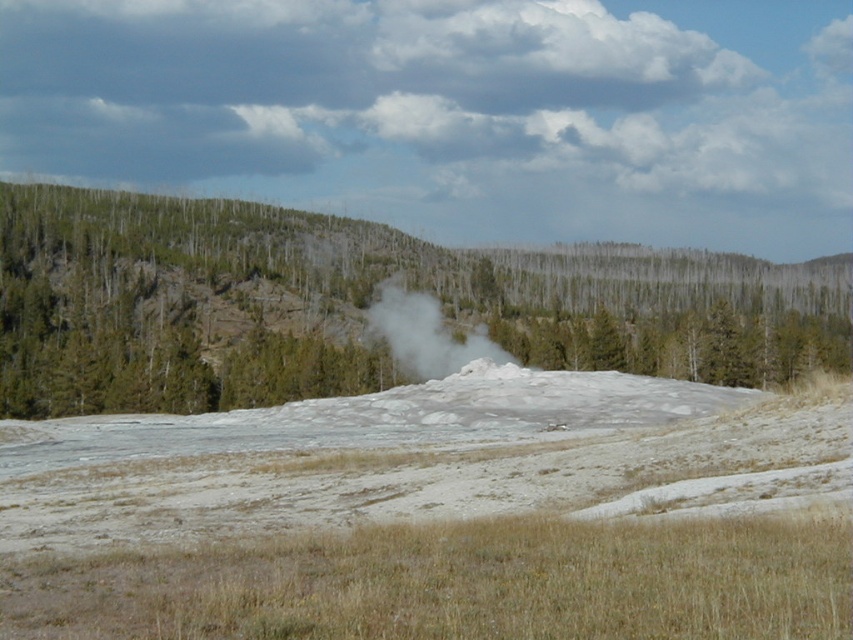
Looking at this image, you are a hiker standing at the edge of the barren area. You see the green textured tree at center and the white steam at center. Which one is closer to you?

The green textured tree at center is 40.98 meters away from the white steam at center. Since you are at the edge of the barren area, the white steam at center is closer to you because it is located in the foreground, while the tree is in the mid or background.

You are a hiker standing at the edge of the barren area. You see the green textured tree at center and the white steam at center. Which object is closer to you?

The green textured tree at center is closer to you because the white steam at center is behind it.